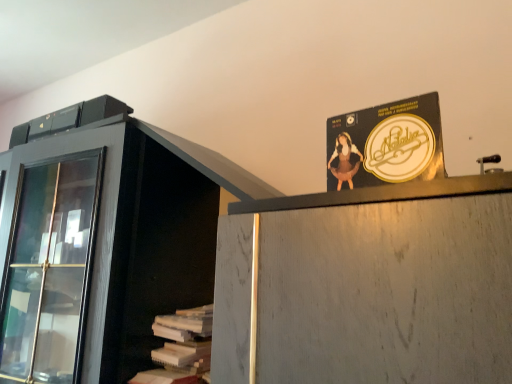
Question: Relative to white paper stack at lower left, is gold metallic record album at upper center in front or behind?

Choices:
 (A) behind
 (B) front

Answer: (B)

Question: Is gold metallic record album at upper center taller or shorter than white paper stack at lower left?

Choices:
 (A) tall
 (B) short

Answer: (B)

Question: From a real-world perspective, is gold metallic record album at upper center physically located above or below white paper stack at lower left?

Choices:
 (A) below
 (B) above

Answer: (B)

Question: Is white paper stack at lower left in front of or behind gold metallic record album at upper center in the image?

Choices:
 (A) front
 (B) behind

Answer: (B)

Question: From a real-world perspective, is white paper stack at lower left positioned above or below gold metallic record album at upper center?

Choices:
 (A) above
 (B) below

Answer: (B)

Question: Is white paper stack at lower left to the left or to the right of gold metallic record album at upper center in the image?

Choices:
 (A) right
 (B) left

Answer: (B)

Question: Looking at their shapes, would you say white paper stack at lower left is wider or thinner than gold metallic record album at upper center?

Choices:
 (A) thin
 (B) wide

Answer: (B)